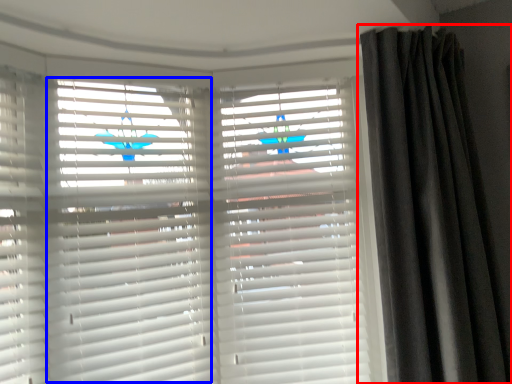
Question: Among these objects, which one is nearest to the camera, curtain (highlighted by a red box) or shutter (highlighted by a blue box)?

Choices:
 (A) curtain
 (B) shutter

Answer: (A)